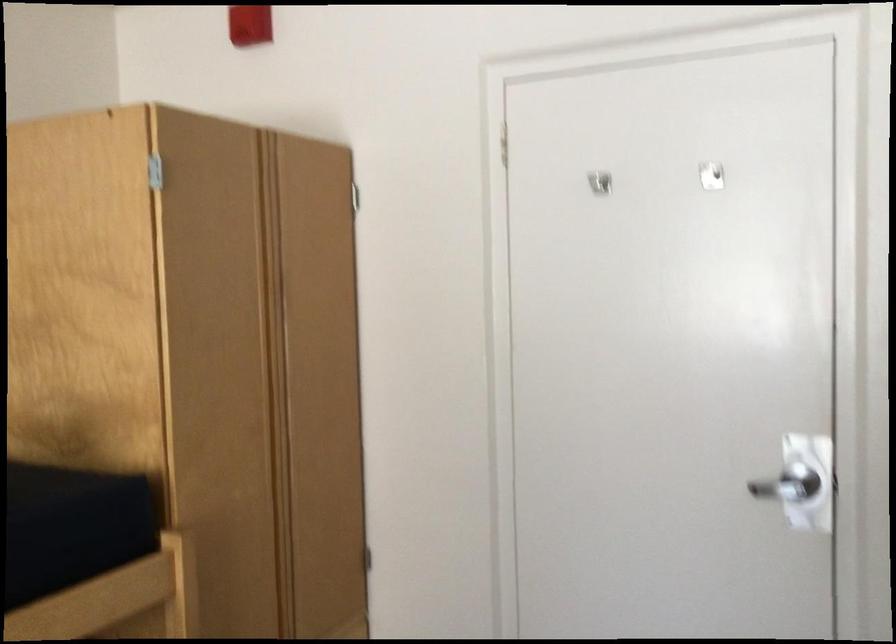
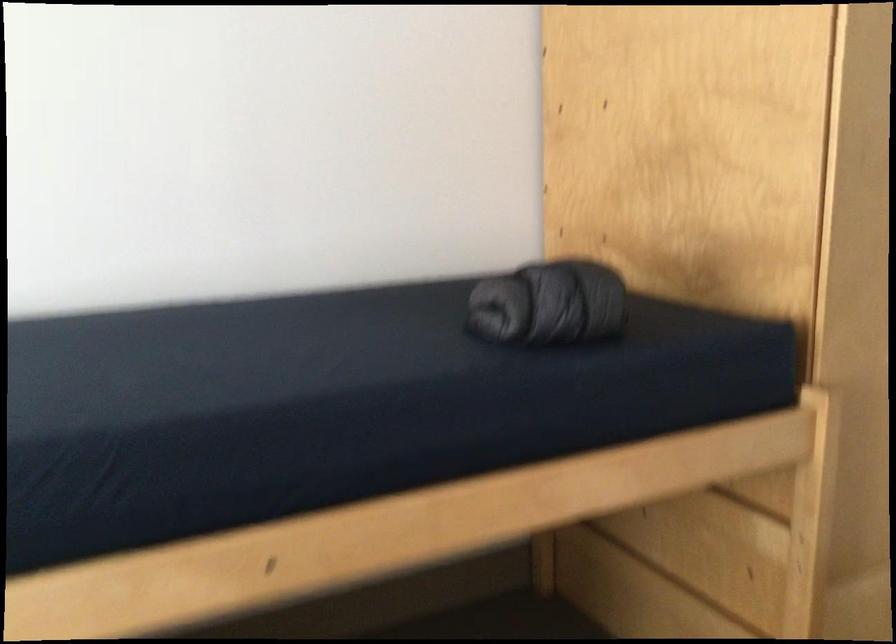
Question: The camera is either moving clockwise (left) or counter-clockwise (right) around the object. The first image is from the beginning of the video and the second image is from the end. Is the camera moving left or right when shooting the video?

Choices:
 (A) Left
 (B) Right

Answer: (B)